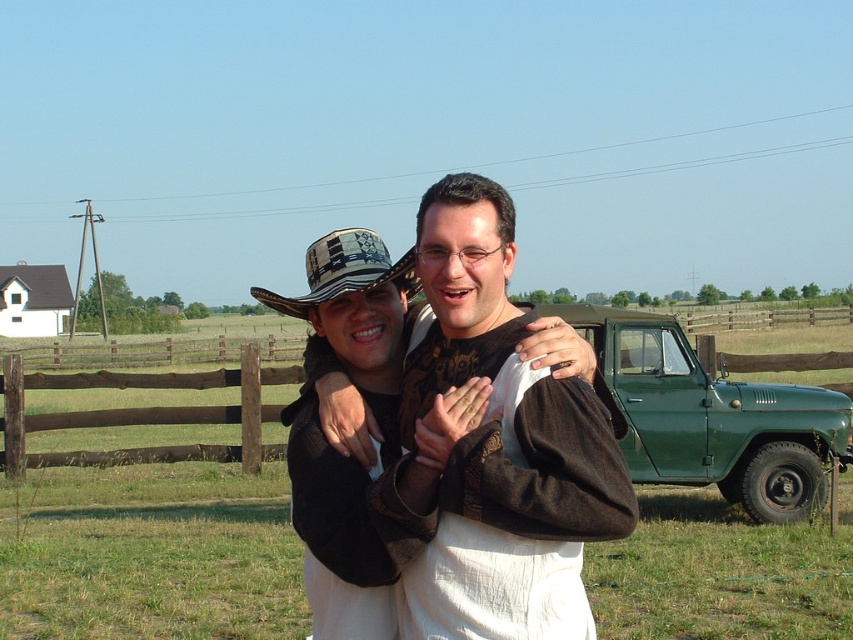
Question: From the image, what is the correct spatial relationship of white cotton shirt at center in relation to brown wooden fence at left?

Choices:
 (A) below
 (B) above

Answer: (B)

Question: Does white cotton shirt at center have a lesser width compared to green matte pickup truck at right?

Choices:
 (A) yes
 (B) no

Answer: (A)

Question: Which point is farther to the camera?

Choices:
 (A) brown wooden fence at left
 (B) patterned fabric cowboy hat at center
 (C) green matte pickup truck at right

Answer: (A)

Question: Where is white cotton shirt at center located in relation to green matte pickup truck at right in the image?

Choices:
 (A) above
 (B) below

Answer: (A)

Question: Estimate the real-world distances between objects in this image. Which object is farther from the brown wooden fence at left?

Choices:
 (A) patterned fabric cowboy hat at center
 (B) green matte pickup truck at right

Answer: (A)

Question: Which point is closer to the camera taking this photo?

Choices:
 (A) (351, 227)
 (B) (479, 452)

Answer: (B)